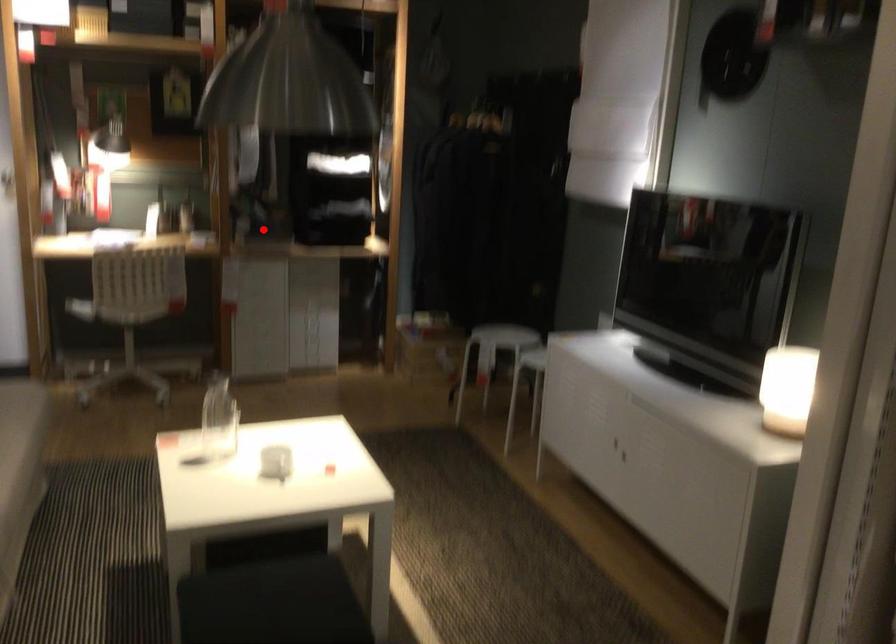
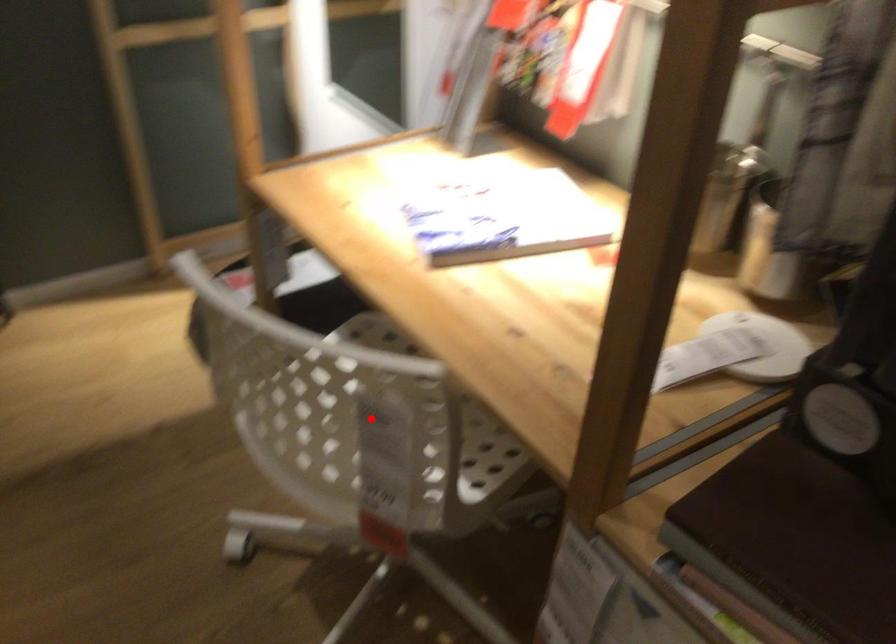
I am providing you with two images of the same scene from different viewpoints. A red point is marked on the first image and another point is marked on the second image. Is the marked point in image1 the same physical position as the marked point in image2?

No